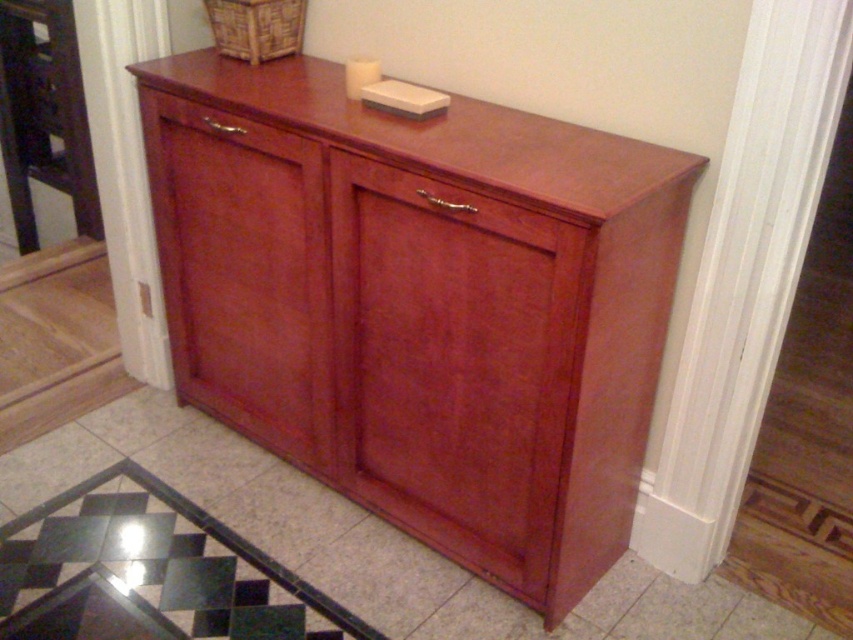
You are moving a large painting that is 1.2 meters wide. You want to place it on the wall between the satin cherry dresser at center and the glossy wood drawer at center. Is there enough space between them to fit the painting?

The satin cherry dresser at center is to the left of the glossy wood drawer at center, but the distance between them is not specified. Without knowing the exact spacing, it is impossible to determine if the 1.2 meter wide painting will fit.

You are standing in front of the wooden cabinet in the hallway. You need to reach a point that is exactly 5 feet away from you. Can you tell me if the point at coordinate (543,141) is exactly 5 feet away from your current position?

Yes, the point at coordinate (543,141) is exactly 5.00 feet away from the viewer, so you can reach it by moving directly towards that point.